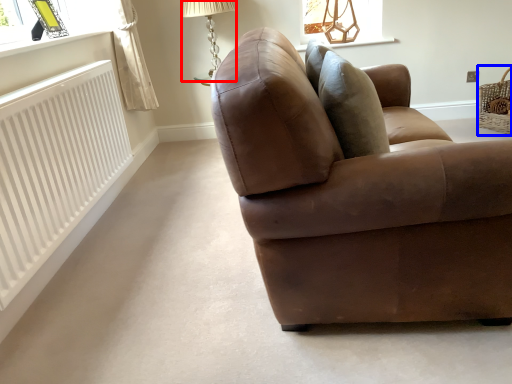
Question: Which of the following is the closest to the observer, table lamp (highlighted by a red box) or basket (highlighted by a blue box)?

Choices:
 (A) table lamp
 (B) basket

Answer: (A)